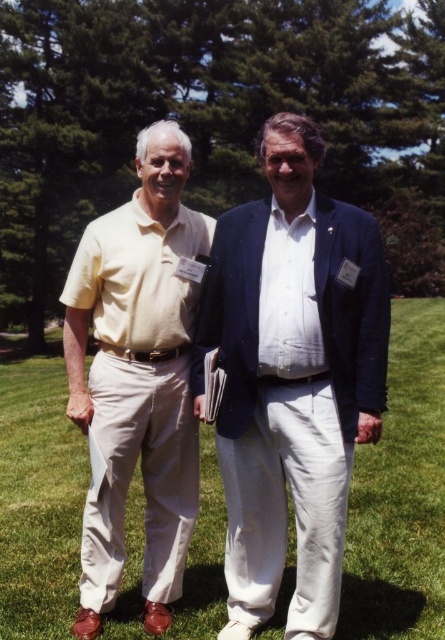
You are a photographer standing 10 feet away from the two people wearing matte yellow shirts. You want to capture both of them in a single photo without moving your position. Given that your camera has a maximum horizontal field of view of 60 degrees, can you fit both the matte yellow shirt at center and the matte yellow shirt at left into the frame?

The matte yellow shirt at center and matte yellow shirt at left are 29.17 inches apart. At a distance of 10 feet, the angle between them can be calculated using trigonometry. The formula is angle in degrees equals arctangent of separation distance divided by distance. Converting inches to feet, 29.17 inches is approximately 2.43 feet. Arctangent of 2.43 divided by 10 equals approximately 13.7 degrees. Since 13.7 degrees is less than the camera maximum field of view of 60 degrees, both shirts can be captured

You are a photographer trying to capture a clear photo of the matte yellow shirt at center. However, the matte yellow shirt at left is blocking your view. Can you adjust your position to take the photo without moving any objects?

The matte yellow shirt at center is positioned under the matte yellow shirt at left. By lowering your camera angle or crouching, you can position yourself below the blocking shirt to capture the matte yellow shirt at center without moving any objects.

You are planning to take a photo of the two people wearing name tags in the park. The person in the matte yellow shirt at center is standing closer to you. How far apart are they?

The two people wearing name tags are 11.38 feet apart.